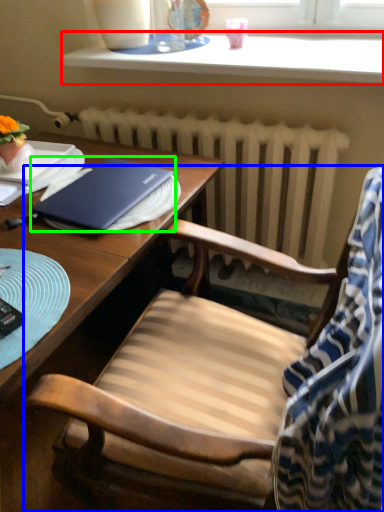
Question: Which object is positioned closest to window sill (highlighted by a red box)? Select from chair (highlighted by a blue box) and notebook (highlighted by a green box).

Choices:
 (A) chair
 (B) notebook

Answer: (B)